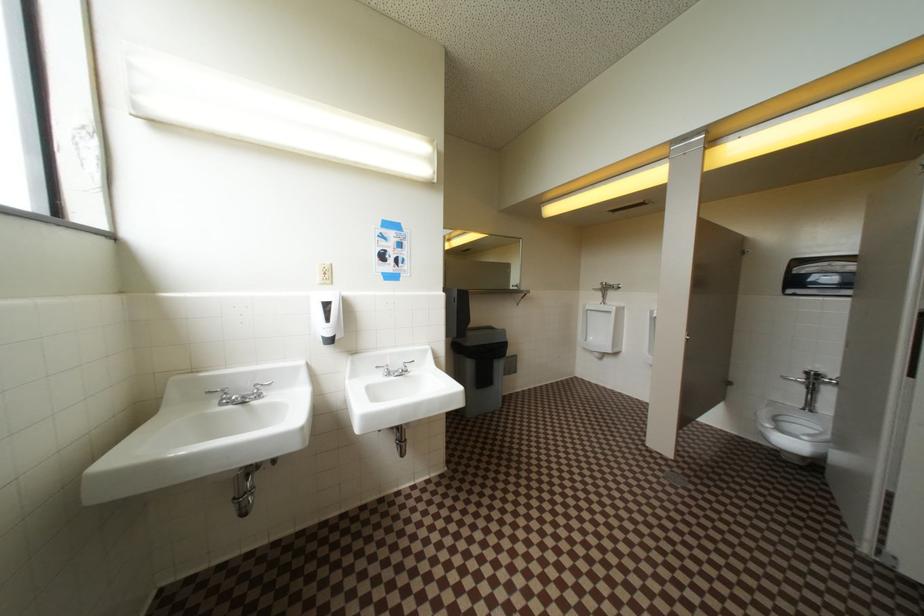
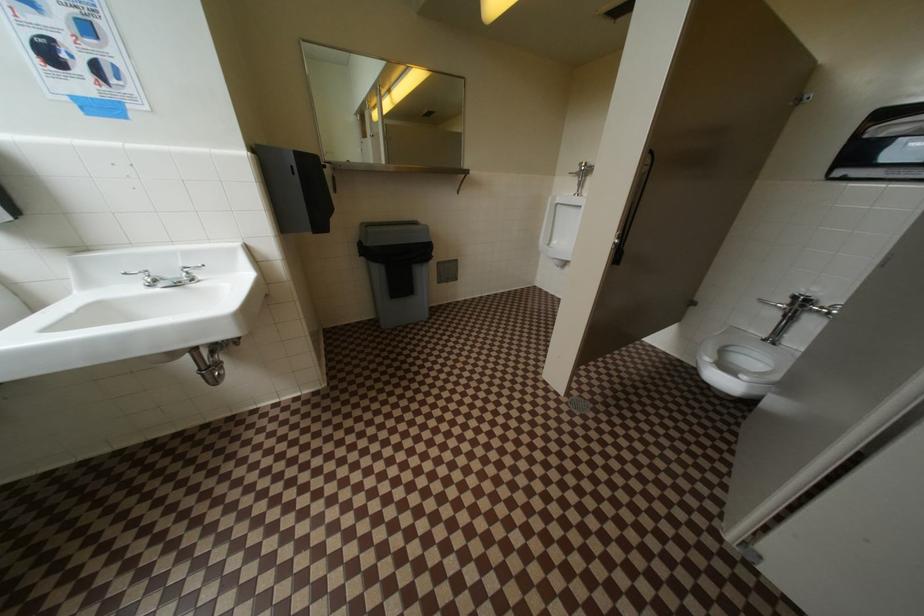
Question: How did the camera likely rotate?

Choices:
 (A) Left
 (B) Right
 (C) Up
 (D) Down

Answer: (D)